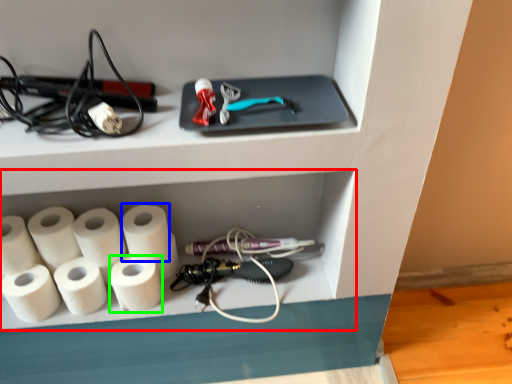
Question: Based on their relative distances, which object is nearer to shelf (highlighted by a red box)? Choose from paper towel (highlighted by a blue box) and paper towel (highlighted by a green box).

Choices:
 (A) paper towel
 (B) paper towel

Answer: (A)